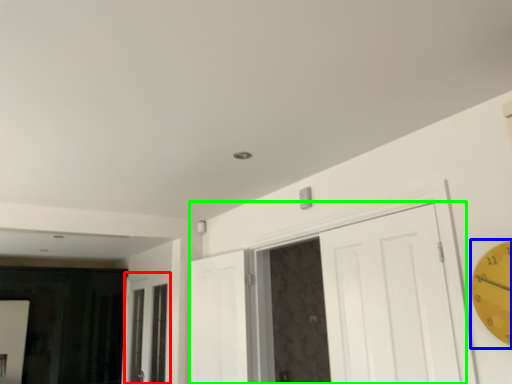
Question: Which object is positioned closest to window (highlighted by a red box)? Select from clock (highlighted by a blue box) and door (highlighted by a green box).

Choices:
 (A) clock
 (B) door

Answer: (B)